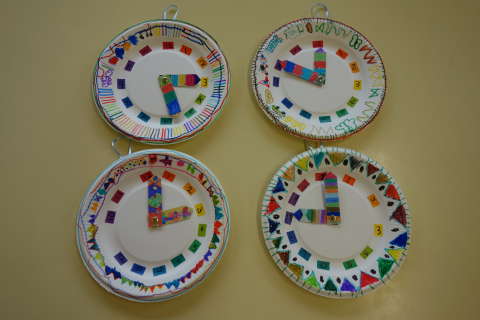
The height and width of the screenshot is (320, 480). Find the location of `clock 2`. clock 2 is located at coordinates (308, 96).